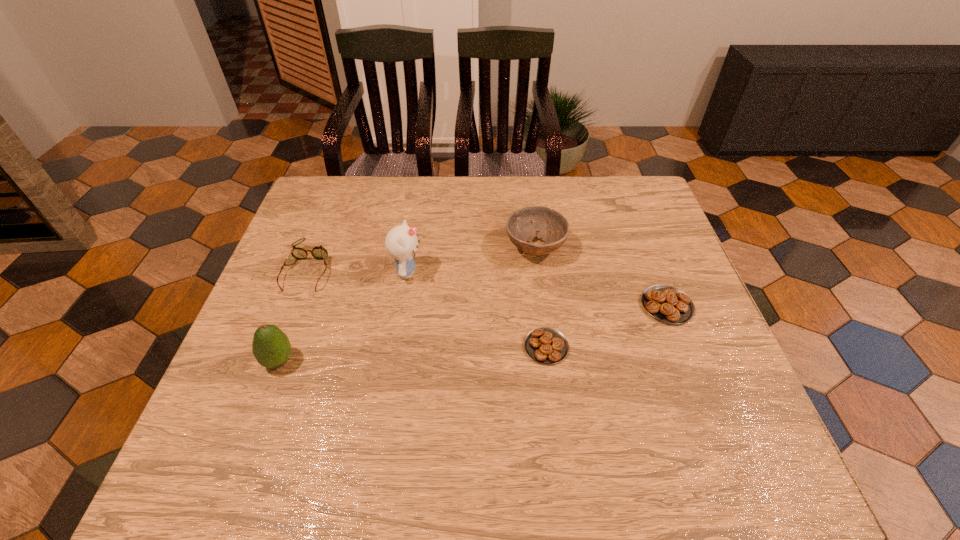
This screenshot has width=960, height=540. Identify the location of free spot located on the left of the right pastry. (550, 306).

Locate an element on the screen. This screenshot has width=960, height=540. vacant position located 0.260m on the front-facing side of the third object from left to right is located at coordinates (522, 272).

This screenshot has height=540, width=960. I want to click on blank space located 0.360m on the front of the third tallest object, so click(x=554, y=393).

I want to click on blank space located on the back of the avocado, so click(308, 281).

You are a GUI agent. You are given a task and a screenshot of the screen. Output one action in this format:
    pyautogui.click(x=<x>, y=<y>)
    Task: Click on the free spot located 0.190m on the front-facing side of the fourth tallest object
    This screenshot has height=540, width=960.
    Given the screenshot: What is the action you would take?
    pyautogui.click(x=275, y=357)

Image resolution: width=960 pixels, height=540 pixels. In order to click on avocado that is positioned at the left edge in this screenshot , I will do `click(271, 347)`.

The image size is (960, 540). In order to click on spectacles present at the left edge in this screenshot , I will do `click(318, 252)`.

The height and width of the screenshot is (540, 960). What are the coordinates of `object that is at the right edge` in the screenshot? It's located at (668, 304).

Image resolution: width=960 pixels, height=540 pixels. In order to click on vacant area at the far edge in this screenshot , I will do `click(403, 179)`.

In order to click on free space at the near edge of the desktop in this screenshot , I will do `click(324, 395)`.